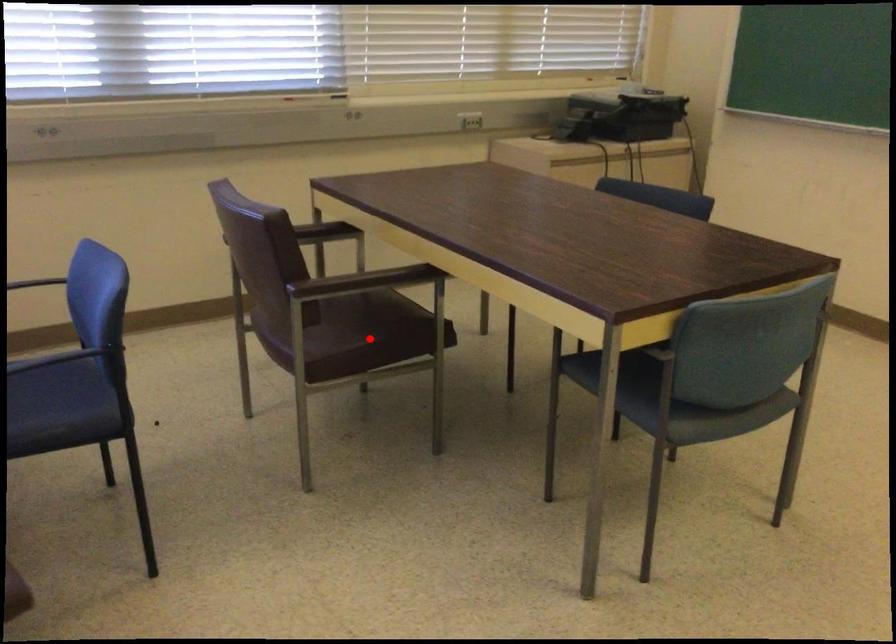
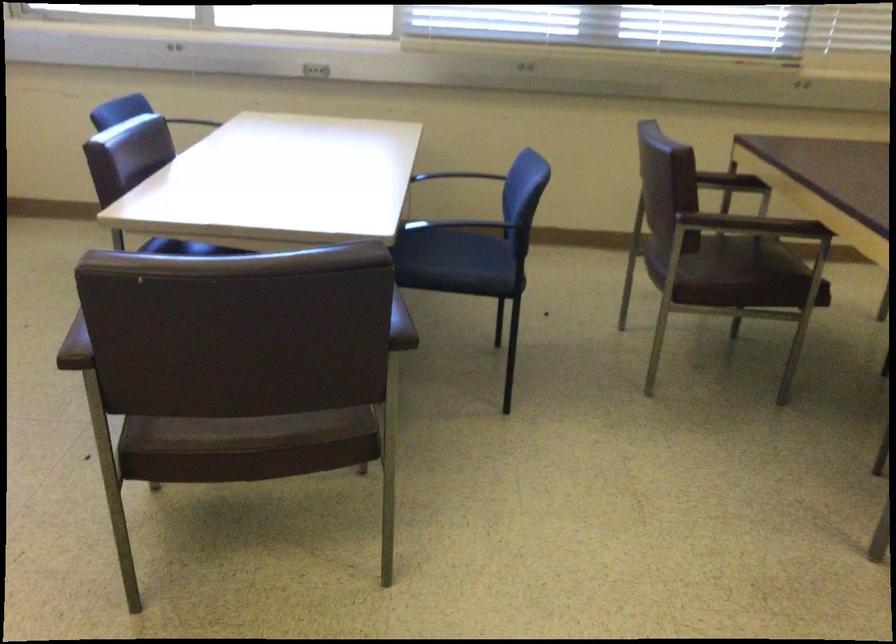
Find the pixel in the second image that matches the highlighted location in the first image.

(739, 278)